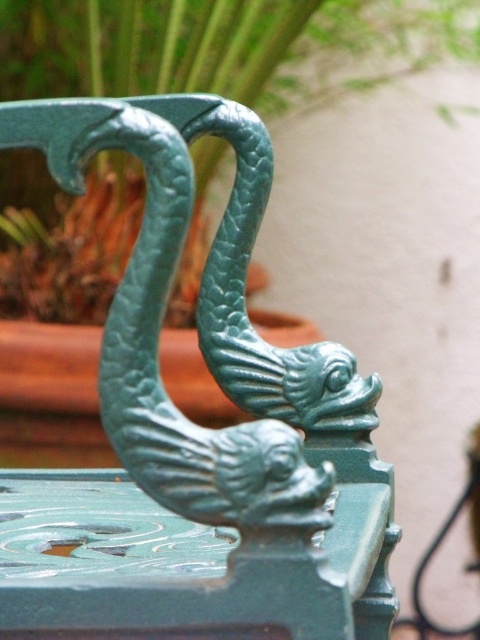
Question: Among these points, which one is nearest to the camera?

Choices:
 (A) (112, 138)
 (B) (345, 90)

Answer: (A)

Question: Which object is farther from the camera taking this photo?

Choices:
 (A) green cast iron dragon at center
 (B) green textured plant at upper center

Answer: (B)

Question: Is the position of green cast iron dragon at center less distant than that of green textured plant at upper center?

Choices:
 (A) no
 (B) yes

Answer: (B)

Question: Can you confirm if green cast iron dragon at center is smaller than green textured plant at upper center?

Choices:
 (A) yes
 (B) no

Answer: (A)

Question: Does green cast iron dragon at center appear under green textured plant at upper center?

Choices:
 (A) no
 (B) yes

Answer: (B)

Question: Which of the following is the closest to the observer?

Choices:
 (A) green cast iron dragon at center
 (B) green textured plant at upper center

Answer: (A)